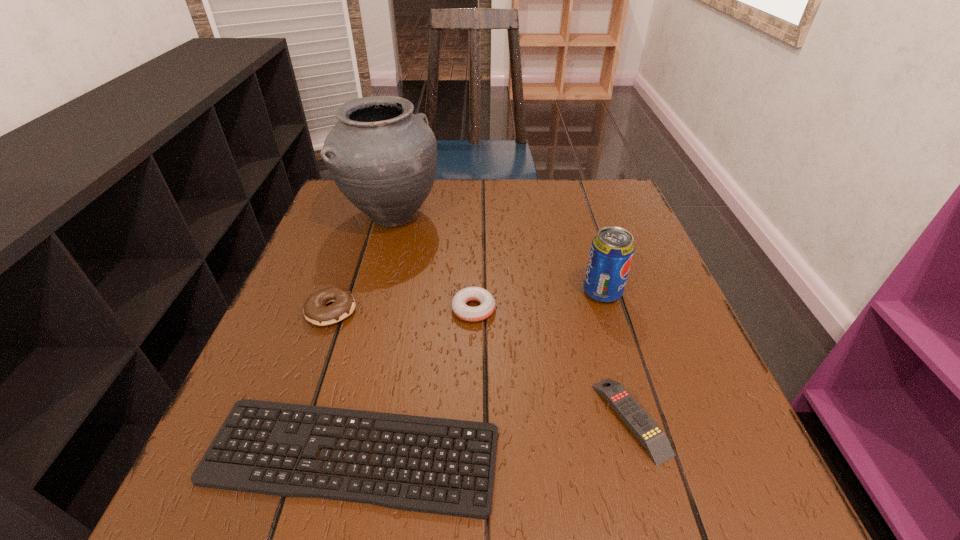
The image size is (960, 540). In the image, there is a desktop. In order to click on vacant space at the far left corner in this screenshot , I will do `click(336, 216)`.

Find the location of a particular element. The width and height of the screenshot is (960, 540). free space at the far right corner of the desktop is located at coordinates (613, 217).

The height and width of the screenshot is (540, 960). Find the location of `empty location between the shortest object and the fifth shortest object`. empty location between the shortest object and the fifth shortest object is located at coordinates tap(477, 374).

Where is `vacant space that's between the left doughnut and the urn`? Image resolution: width=960 pixels, height=540 pixels. vacant space that's between the left doughnut and the urn is located at coordinates (362, 264).

Identify the location of unoccupied position between the fourth tallest object and the tallest object. (433, 263).

Locate an element on the screen. vacant area between the farthest object and the remote control is located at coordinates (512, 318).

The height and width of the screenshot is (540, 960). Find the location of `unoccupied area between the shorter doughnut and the second shortest object`. unoccupied area between the shorter doughnut and the second shortest object is located at coordinates (552, 364).

Where is `free point between the remote control and the third tallest object`? free point between the remote control and the third tallest object is located at coordinates (481, 364).

In order to click on free space between the computer keyboard and the left doughnut in this screenshot , I will do `click(342, 383)`.

Find the location of a particular element. free space between the fifth shortest object and the urn is located at coordinates (497, 254).